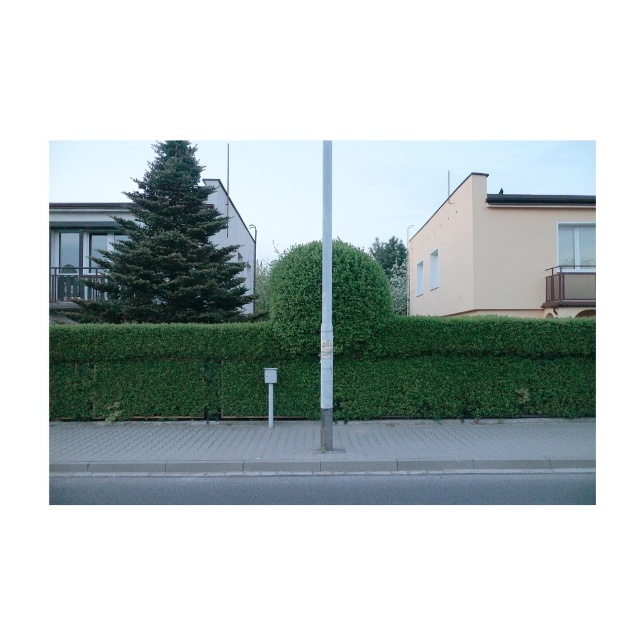
Question: Is gray concrete pavement at center to the left of green leafy tree at upper center from the viewer's perspective?

Choices:
 (A) no
 (B) yes

Answer: (B)

Question: Is gray concrete pavement at center wider than metallic gray street sign at center?

Choices:
 (A) yes
 (B) no

Answer: (A)

Question: Estimate the real-world distances between objects in this image. Which object is closer to the gray concrete curb at lower center?

Choices:
 (A) green leafy tree at upper center
 (B) green needle-like tree at upper left
 (C) green leafy bush at center

Answer: (C)

Question: Which point appears farthest from the camera in this image?

Choices:
 (A) (319, 257)
 (B) (474, 442)
 (C) (193, 166)
 (D) (237, 493)

Answer: (C)

Question: Among these points, which one is nearest to the camera?

Choices:
 (A) (177, 294)
 (B) (322, 365)
 (C) (226, 470)

Answer: (C)

Question: Is smooth white pole at center above green leafy tree at upper center?

Choices:
 (A) no
 (B) yes

Answer: (B)